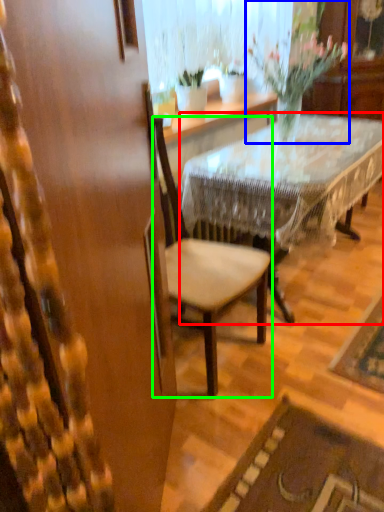
Question: Which is nearer to the desk (highlighted by a red box)? houseplant (highlighted by a blue box) or chair (highlighted by a green box).

Choices:
 (A) houseplant
 (B) chair

Answer: (B)